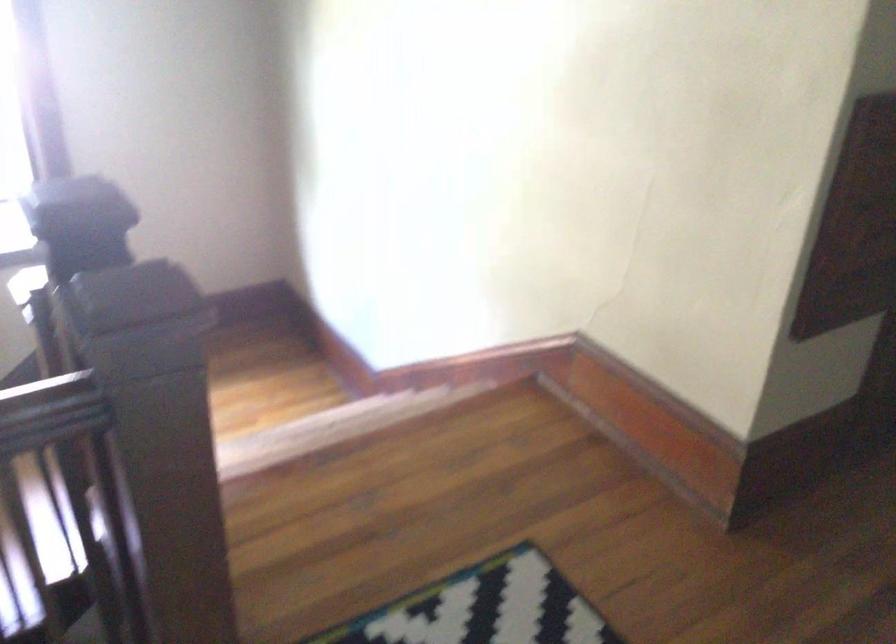
The height and width of the screenshot is (644, 896). I want to click on wooden newel post, so click(x=158, y=435).